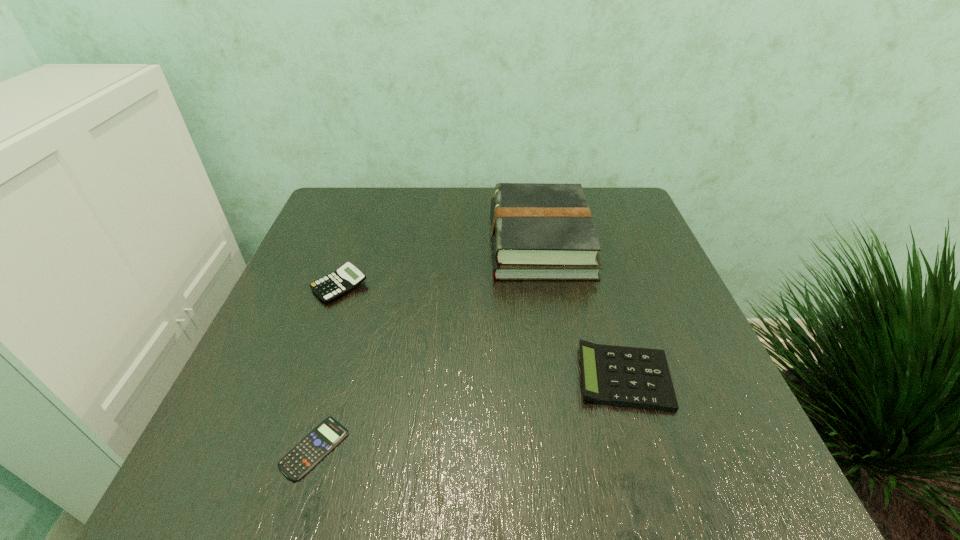
Locate an element on the screen. free space located 0.100m on the front of the second nearest object is located at coordinates (653, 471).

Find the location of a particular element. free space located on the right of the shortest object is located at coordinates (474, 448).

At what (x,y) coordinates should I click in order to perform the action: click on object that is positioned at the far edge. Please return your answer as a coordinate pair (x, y). Looking at the image, I should click on (539, 231).

Find the location of `object at the near edge`. object at the near edge is located at coordinates (307, 453).

Locate an element on the screen. The width and height of the screenshot is (960, 540). hardback book that is at the right edge is located at coordinates (539, 231).

Where is `calculator situated at the right edge`? The image size is (960, 540). calculator situated at the right edge is located at coordinates (634, 377).

This screenshot has width=960, height=540. In order to click on object present at the near left corner in this screenshot , I will do `click(307, 453)`.

Locate an element on the screen. object that is at the far right corner is located at coordinates (539, 231).

The height and width of the screenshot is (540, 960). Find the location of `free space at the far edge`. free space at the far edge is located at coordinates (417, 235).

Identify the location of free location at the near edge of the desktop. (419, 474).